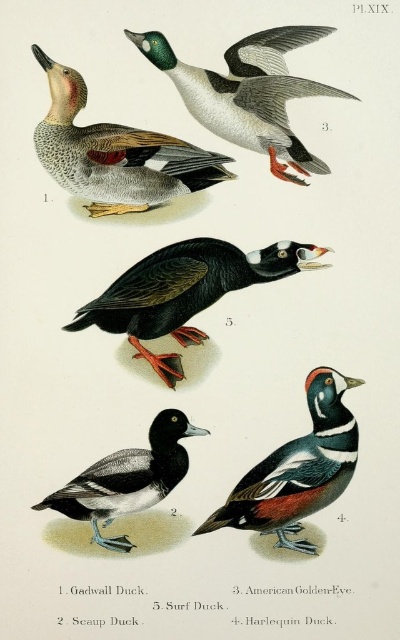
Does matte black duck at upper left have a greater width compared to black glossy surf duck at center?

No.

Does matte black duck at upper left have a greater height compared to black glossy surf duck at center?

Yes, matte black duck at upper left is taller than black glossy surf duck at center.

At what (x,y) coordinates should I click in order to perform the action: click on matte black duck at upper left. Please return your answer as a coordinate pair (x, y). The height and width of the screenshot is (640, 400). Looking at the image, I should click on (114, 154).

Does green glossy duck at upper center have a greater height compared to black glossy duck at center?

Yes, green glossy duck at upper center is taller than black glossy duck at center.

Is green glossy duck at upper center below black glossy duck at center?

No.

Is point (294, 176) in front of point (170, 488)?

No, it is behind (170, 488).

You are a GUI agent. You are given a task and a screenshot of the screen. Output one action in this format:
    pyautogui.click(x=<x>, y=<y>)
    Task: Click on the green glossy duck at upper center
    This screenshot has width=400, height=640.
    Given the screenshot: What is the action you would take?
    pyautogui.click(x=249, y=93)

Is matte black duck at upper left to the right of black glossy duck at center from the viewer's perspective?

In fact, matte black duck at upper left is to the left of black glossy duck at center.

Is point (182, 164) more distant than point (146, 484)?

Yes, point (182, 164) is behind point (146, 484).

This screenshot has width=400, height=640. Identify the location of matte black duck at upper left. (114, 154).